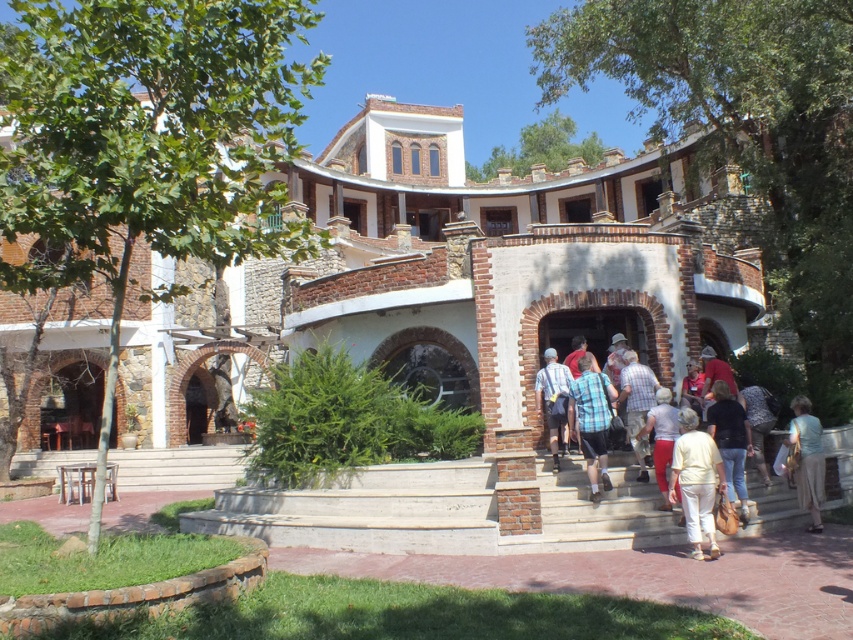
You are a tour guide standing at the base of the steps leading to the building. You need to hand out a brochure to both the person wearing light beige pants at lower right and the person in plaid shirt at center. Can you reach both individuals without moving from your current position?

The light beige pants at lower right and plaid shirt at center are 8.77 feet apart. Since the tour guide is at the base of the steps, they can likely reach both individuals without moving, as 8.77 feet is a reasonable distance for handing out brochures while staying in place.

From the picture: You are standing on the paved area in front of the building and notice two people wearing light beige pants at lower right and plaid shirt at center. Which person is closer to the ground?

The light beige pants at lower right is below plaid shirt at center, so the person wearing light beige pants at lower right is closer to the ground.